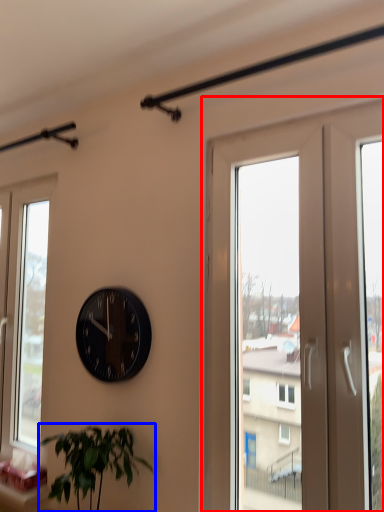
Question: Which of the following is the closest to the observer, screen door (highlighted by a red box) or houseplant (highlighted by a blue box)?

Choices:
 (A) screen door
 (B) houseplant

Answer: (A)